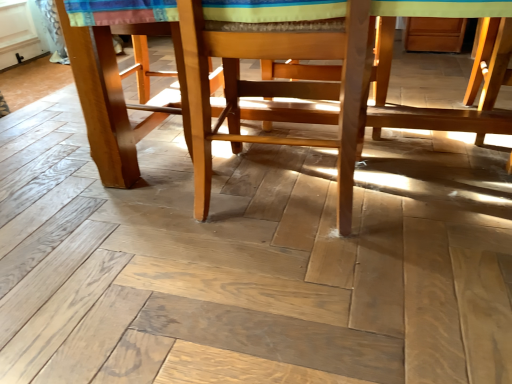
What do you see at coordinates (322, 79) in the screenshot? I see `wooden chair at center` at bounding box center [322, 79].

The height and width of the screenshot is (384, 512). I want to click on wooden chair at center, so click(x=322, y=79).

Locate an element on the screen. This screenshot has width=512, height=384. wooden chair at center is located at coordinates (322, 79).